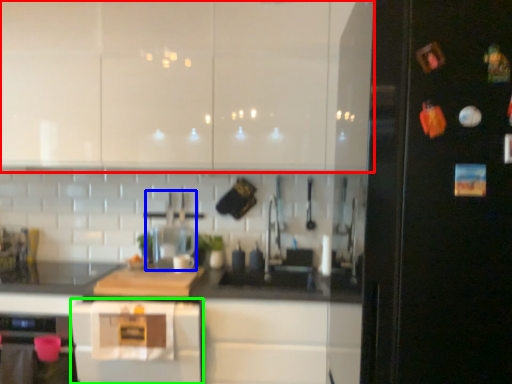
Question: Based on their relative distances, which object is farther from cabinetry (highlighted by a red box)? Choose from appliance (highlighted by a blue box) and home appliance (highlighted by a green box).

Choices:
 (A) appliance
 (B) home appliance

Answer: (B)